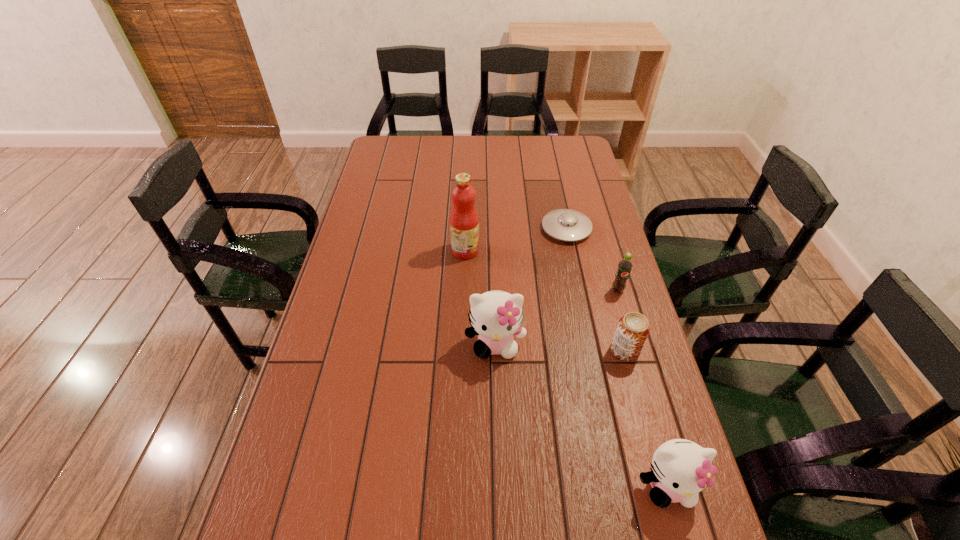
This screenshot has height=540, width=960. I want to click on vacant space located 0.290m on the left of the shortest object, so click(x=460, y=229).

Locate an element on the screen. The image size is (960, 540). vacant area situated on the left of the second shortest object is located at coordinates coord(470,350).

Where is `free space located on the front label of the third farthest object`? The width and height of the screenshot is (960, 540). free space located on the front label of the third farthest object is located at coordinates (630, 332).

I want to click on object that is at the near edge, so click(681, 469).

This screenshot has width=960, height=540. Find the location of `kitten situated at the right edge`. kitten situated at the right edge is located at coordinates tap(681, 469).

Where is `saucer at the right edge`? saucer at the right edge is located at coordinates (568, 225).

The height and width of the screenshot is (540, 960). Identify the location of beer can present at the right edge. (633, 328).

Image resolution: width=960 pixels, height=540 pixels. I want to click on soda that is at the right edge, so click(625, 265).

At what (x,y) coordinates should I click in order to perform the action: click on object that is at the near right corner. Please return your answer as a coordinate pair (x, y). Looking at the image, I should click on (681, 469).

At what (x,y) coordinates should I click in order to perform the action: click on vacant area at the far edge. Please return your answer as a coordinate pair (x, y). This screenshot has width=960, height=540. Looking at the image, I should click on (484, 154).